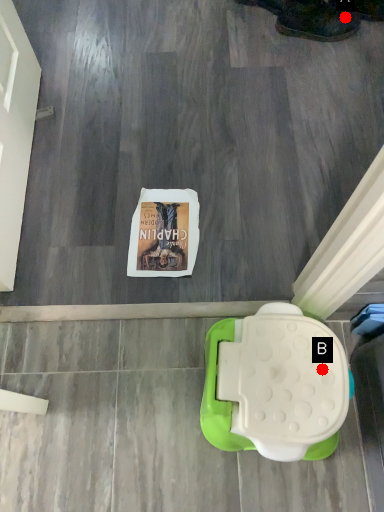
Question: Two points are circled on the image, labeled by A and B beside each circle. Among these points, which one is nearest to the camera?

Choices:
 (A) A is closer
 (B) B is closer

Answer: (B)